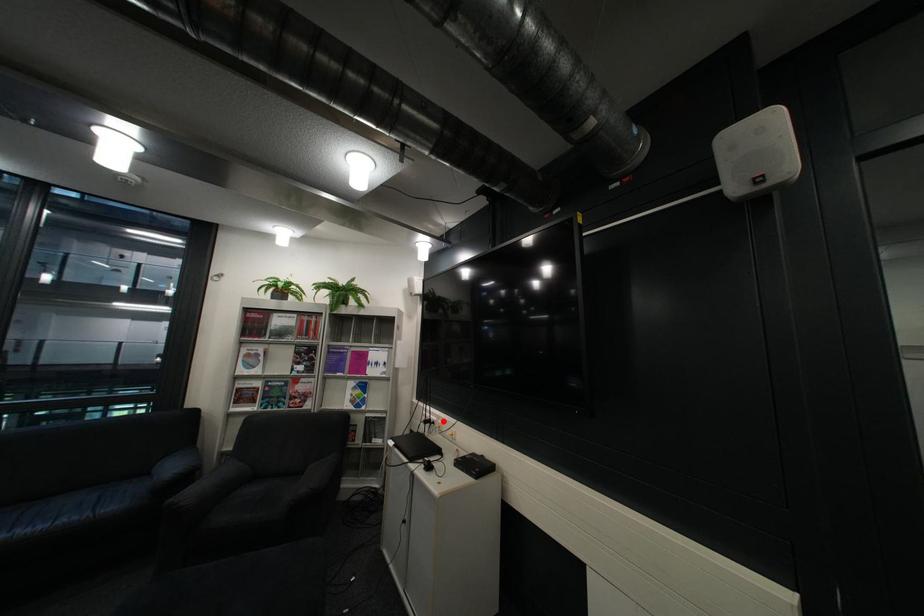
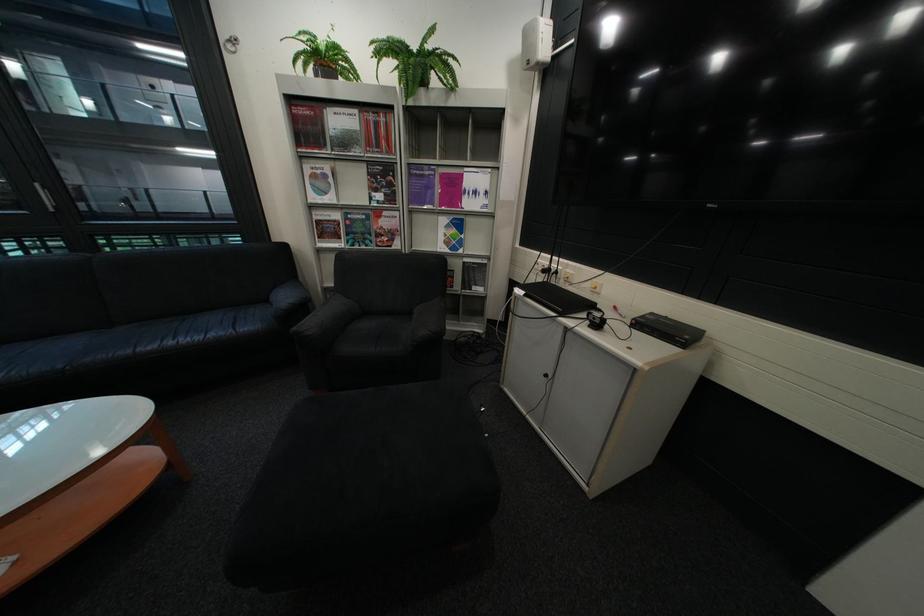
Find the pixel in the second image that matches the highlighted location in the first image.

(563, 270)